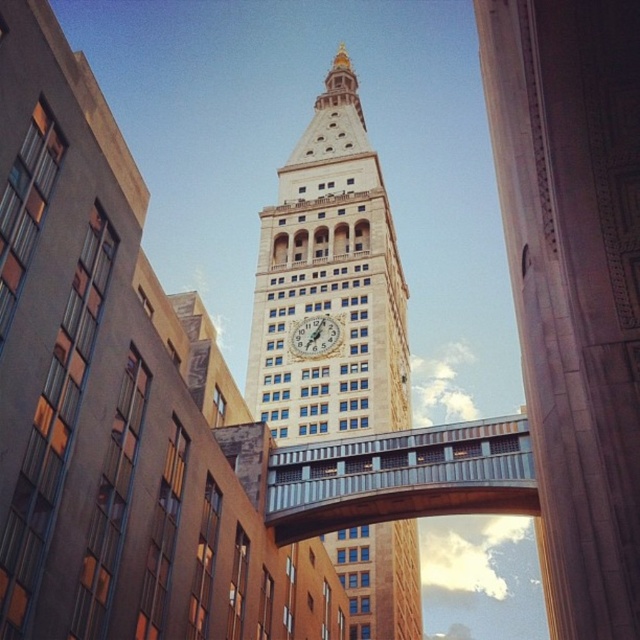
You are standing at the point with coordinates (x=330, y=282). Based on the scene, what structure are you directly facing?

The point at coordinates (x=330, y=282) indicates that you are directly facing the beige stone clock tower at center.

You are an architect reviewing the blueprint of a city square. You notice two key elements in the design, the marble column at center and the white stone clock at center. According to the blueprint, which of these two elements is placed to the right of the other?

The marble column at center is positioned on the right side of white stone clock at center.